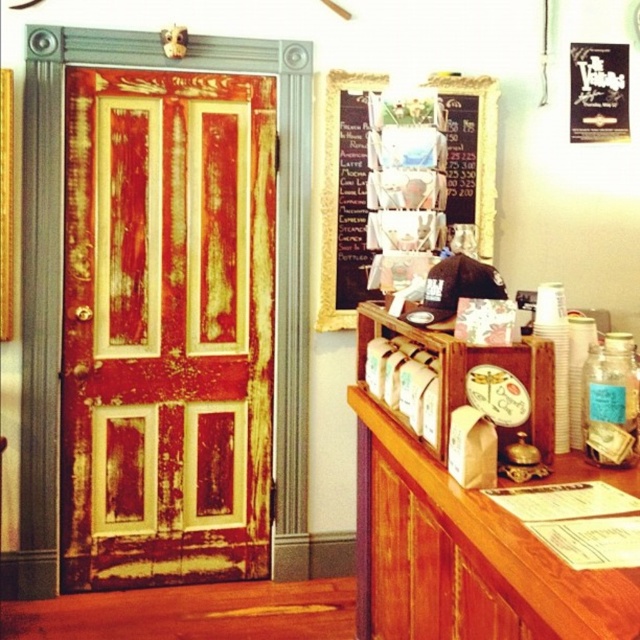
Can you confirm if rusty wood door at left is taller than chalkboard menu at upper center?

Yes.

Measure the distance between rusty wood door at left and chalkboard menu at upper center.

They are 28.89 inches apart.

Where is `rusty wood door at left`? The height and width of the screenshot is (640, 640). rusty wood door at left is located at coordinates (166, 326).

Identify the location of rusty wood door at left. (166, 326).